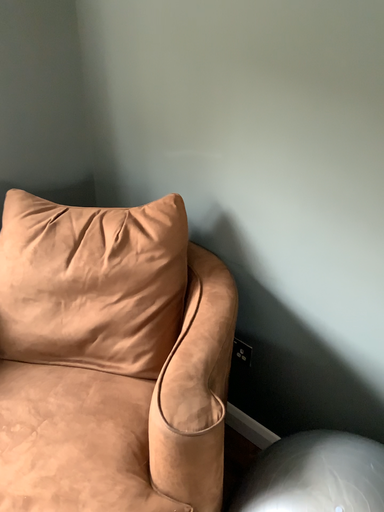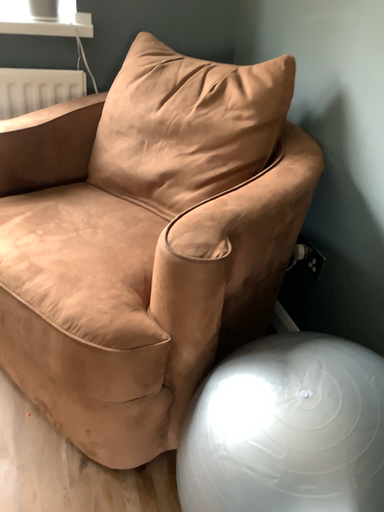
Question: How did the camera likely rotate when shooting the video?

Choices:
 (A) rotated right
 (B) rotated left

Answer: (B)